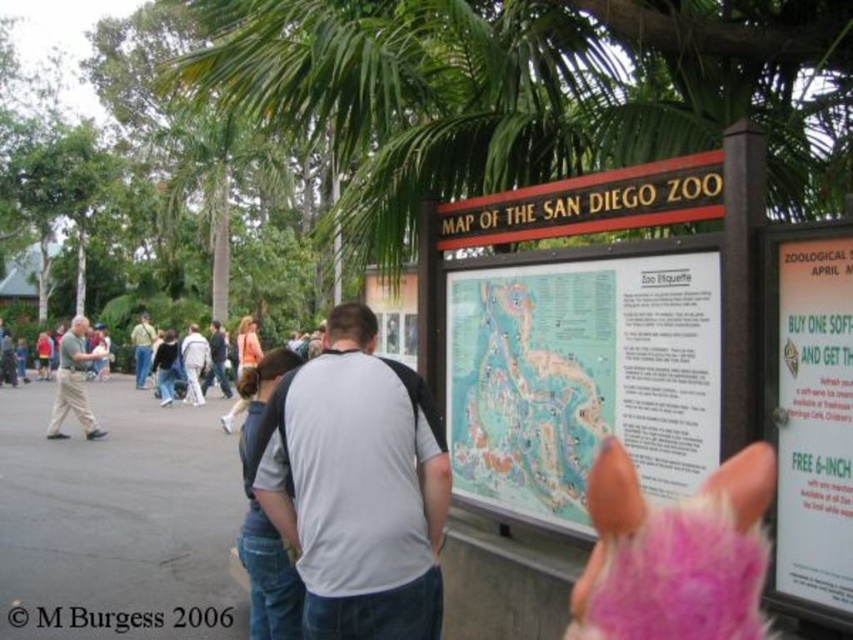
Is point (289, 403) more distant than point (82, 355)?

No, it is in front of (82, 355).

Can you confirm if gray fabric shirt at center is smaller than light gray cotton shirt at left?

Indeed, gray fabric shirt at center has a smaller size compared to light gray cotton shirt at left.

I want to click on gray fabric shirt at center, so click(357, 486).

Is gray fabric shirt at center below pink fluffy ears at center?

Incorrect, gray fabric shirt at center is not positioned below pink fluffy ears at center.

Is point (331, 416) behind point (625, 627)?

No, (331, 416) is in front of (625, 627).

I want to click on gray fabric shirt at center, so click(x=357, y=486).

Can you confirm if white paper sign at right is positioned to the left of light gray cotton shirt at left?

No, white paper sign at right is not to the left of light gray cotton shirt at left.

Between white paper sign at right and light gray cotton shirt at left, which one appears on the right side from the viewer's perspective?

white paper sign at right

Between point (843, 465) and point (91, 429), which one is positioned in front?

Point (843, 465) is in front.

Locate an element on the screen. Image resolution: width=853 pixels, height=640 pixels. white paper sign at right is located at coordinates (814, 420).